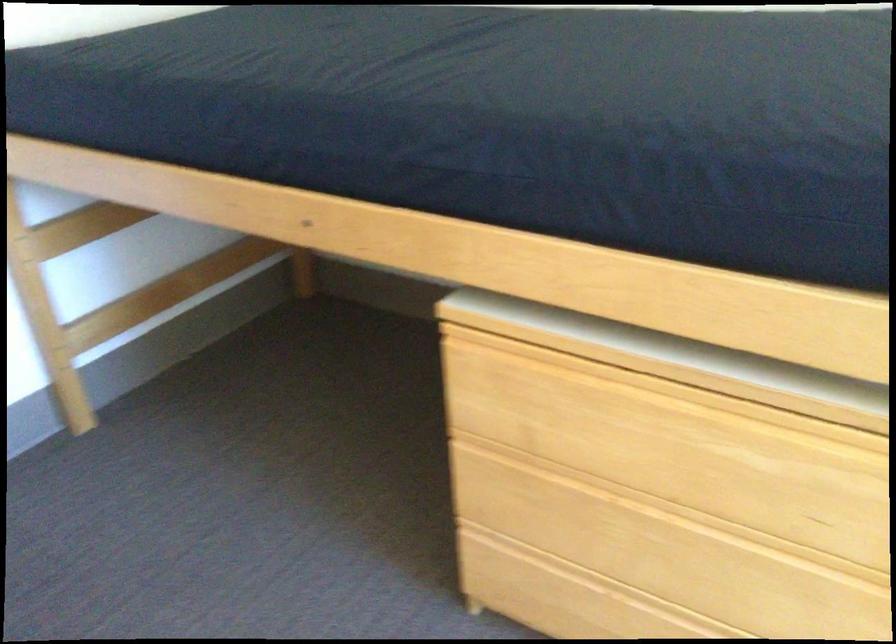
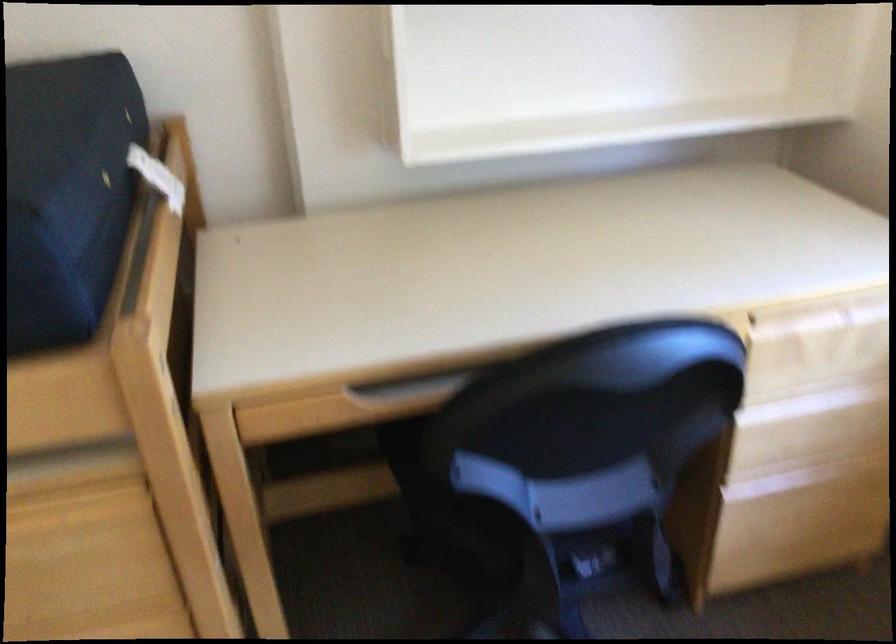
Question: The camera is either moving clockwise (left) or counter-clockwise (right) around the object. The first image is from the beginning of the video and the second image is from the end. Is the camera moving left or right when shooting the video?

Choices:
 (A) Left
 (B) Right

Answer: (A)